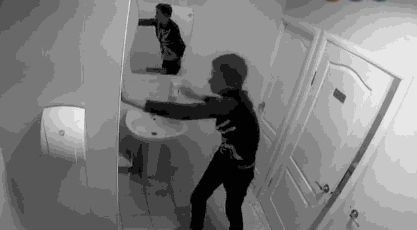
Locate an element on the screen. This screenshot has height=230, width=417. sink is located at coordinates (133, 118).